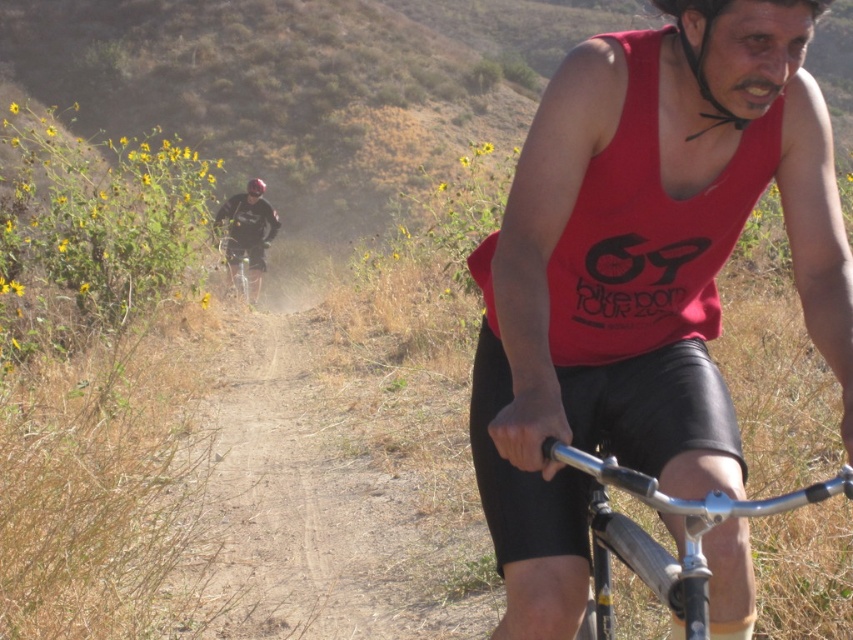
You are a photographer trying to capture both cyclists in a single shot. The first cyclist is at point (x=682, y=582) and the second is at point (x=701, y=35). Based on their positions, which cyclist will appear larger in the photo?

Point (x=682, y=582) is closer to the camera than point (x=701, y=35), so the cyclist at point (x=682, y=582) will appear larger in the photo.

You are a photographer trying to capture both cyclists in a single shot. The first cyclist is at point (647, 499) and the second cyclist is at point (238, 259). Which cyclist should you focus on first to ensure both are in focus?

You should focus on the cyclist at point (647, 499) first because it is closer to the camera. Since it is closer, adjusting focus from near to far increases the chance of both being in focus when using depth of field.